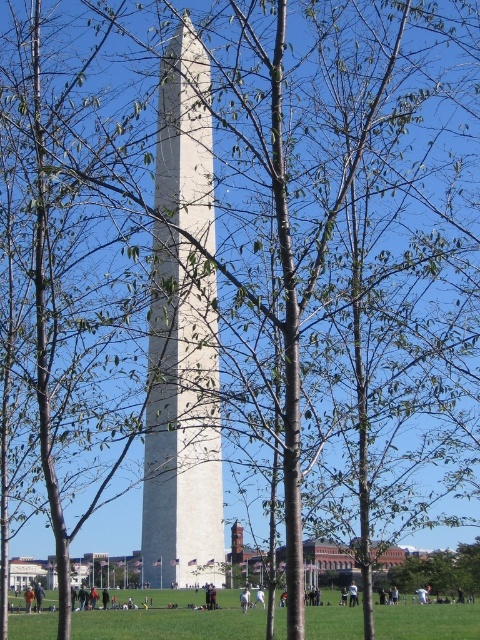
Question: Does green grass at lower center appear over green leafy tree at lower right?

Choices:
 (A) yes
 (B) no

Answer: (B)

Question: Estimate the real-world distances between objects in this image. Which object is closer to the orange fabric person at center?

Choices:
 (A) light blue shirt at center
 (B) green grass at lower center
 (C) white cotton pants at center
 (D) white marble obelisk at center

Answer: (C)

Question: Does green grass at lower center appear over light blue shirt at center?

Choices:
 (A) yes
 (B) no

Answer: (B)

Question: Which object is positioned closest to the white marble obelisk at center?

Choices:
 (A) light blue shirt at center
 (B) orange fabric person at center
 (C) green leafy tree at lower right

Answer: (B)

Question: Estimate the real-world distances between objects in this image. Which object is closer to the white cotton pants at center?

Choices:
 (A) orange fabric person at lower center
 (B) green leafy tree at lower right

Answer: (A)

Question: Does green grass at lower center have a larger size compared to white cotton pants at center?

Choices:
 (A) no
 (B) yes

Answer: (B)